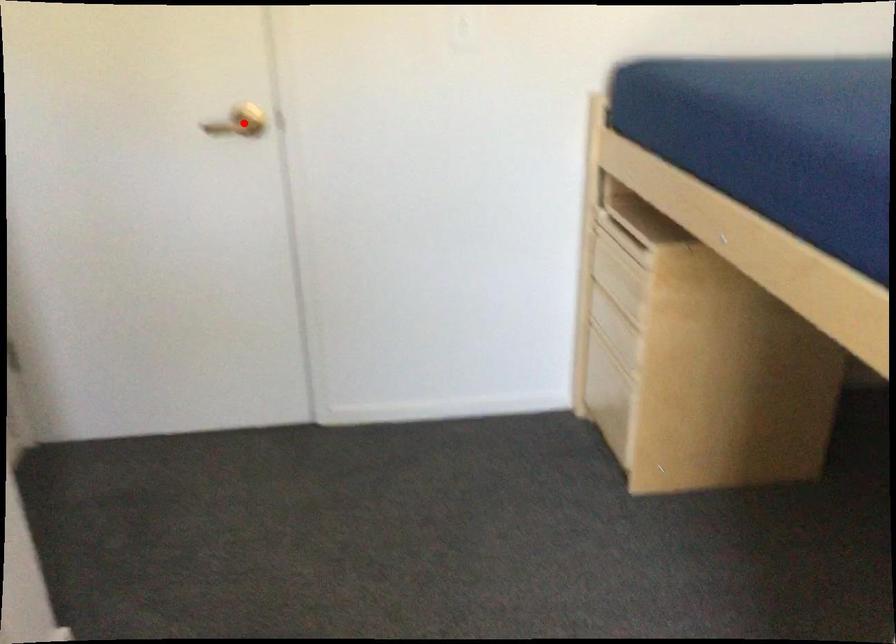
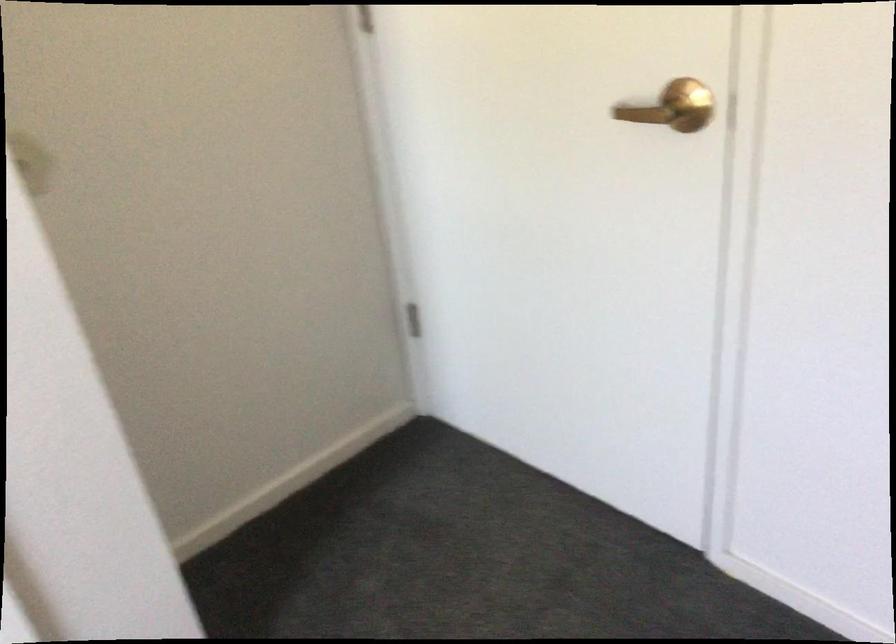
Locate, in the second image, the point that corresponds to the highlighted location in the first image.

(673, 107)